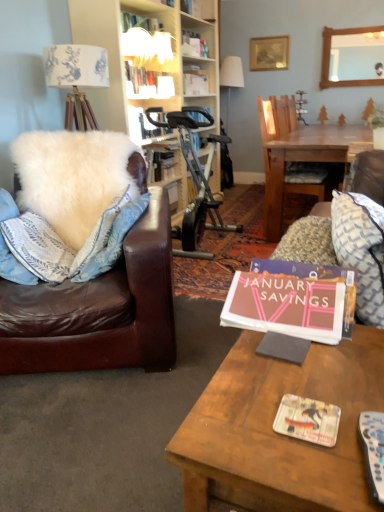
Find the location of a particular element. free space between white plastic remote control at lower right and matte paper magazine at center is located at coordinates (332, 458).